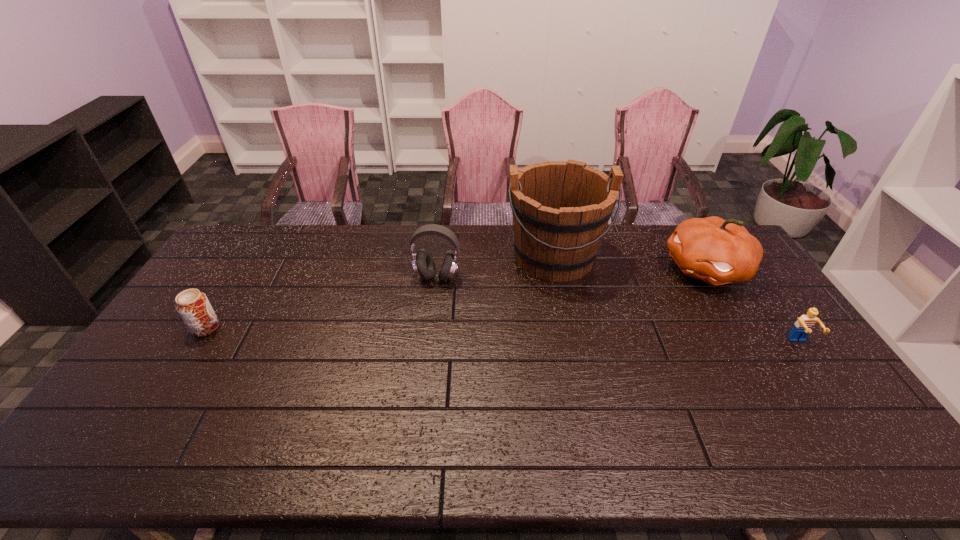
Identify the location of Lego at the right edge. The height and width of the screenshot is (540, 960). click(804, 325).

This screenshot has height=540, width=960. Find the location of `pumpkin present at the right edge`. pumpkin present at the right edge is located at coordinates (716, 251).

At what (x,y) coordinates should I click in order to perform the action: click on object located at the far right corner. Please return your answer as a coordinate pair (x, y). The height and width of the screenshot is (540, 960). Looking at the image, I should click on (716, 251).

Locate an element on the screen. vacant area at the far edge is located at coordinates (348, 239).

Find the location of `vacant space at the near edge of the desktop`. vacant space at the near edge of the desktop is located at coordinates point(501,399).

Locate an element on the screen. The height and width of the screenshot is (540, 960). blank space at the left edge of the desktop is located at coordinates (217, 269).

The width and height of the screenshot is (960, 540). Identify the location of free space at the right edge. (760, 303).

In the image, there is a desktop. At what (x,y) coordinates should I click in order to perform the action: click on vacant space at the far left corner. Please return your answer as a coordinate pair (x, y). This screenshot has width=960, height=540. Looking at the image, I should click on (252, 240).

The height and width of the screenshot is (540, 960). Identify the location of blank region between the Lego and the pumpkin. (753, 306).

This screenshot has height=540, width=960. What are the coordinates of `empty location between the third object from right to left and the Lego` in the screenshot? It's located at (677, 299).